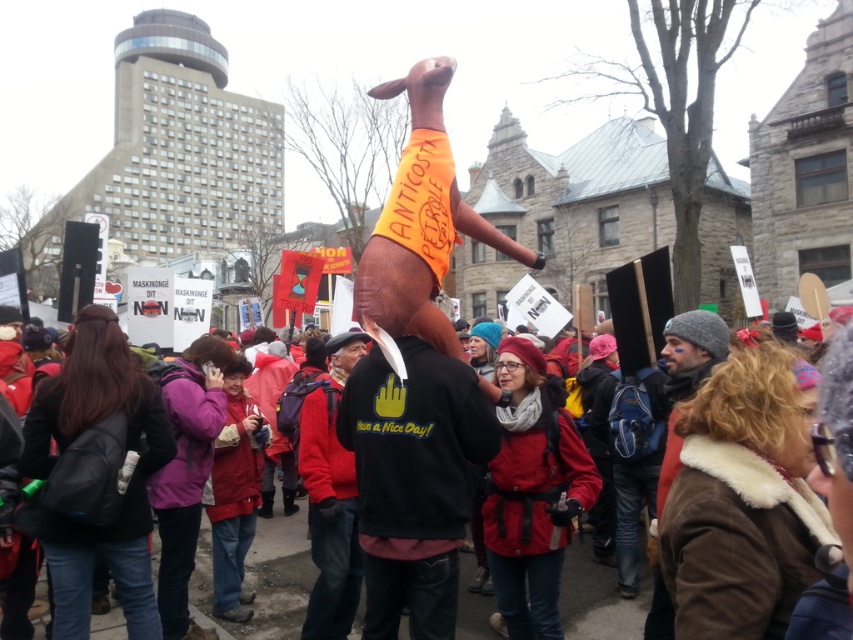
You are a photographer trying to capture both the black matte hoodie at center and the brown fur coat at right in a single frame. Based on their heights, which object should you focus on first to ensure both are in the shot?

The black matte hoodie at center is shorter than the brown fur coat at right. To include both in the frame, focus on the taller brown fur coat at right first, then adjust the camera angle to include the shorter black matte hoodie at center.